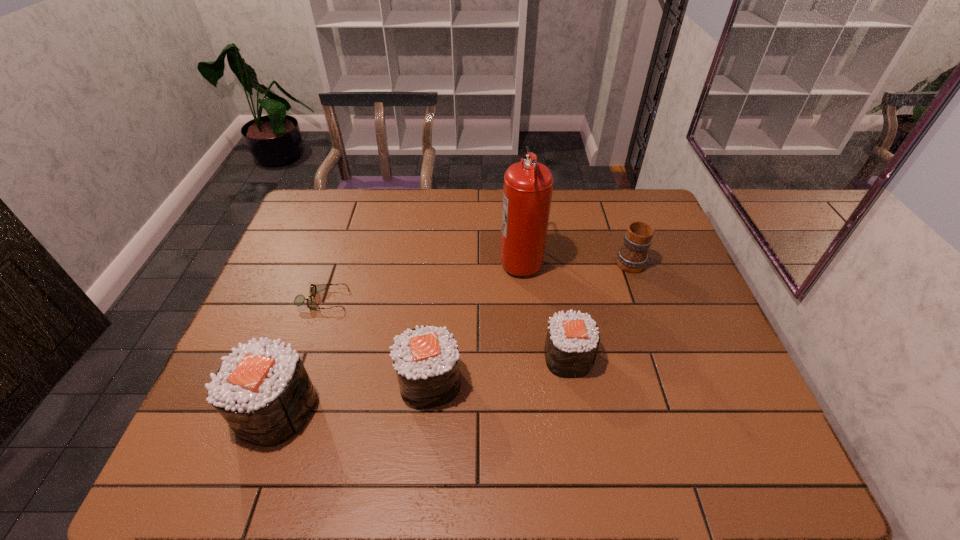
Please point a free position for a sushi on the right. Please provide its 2D coordinates. Your answer should be formatted as a tuple, i.e. [(x, y)], where the tuple contains the x and y coordinates of a point satisfying the conditions above.

[(694, 334)]